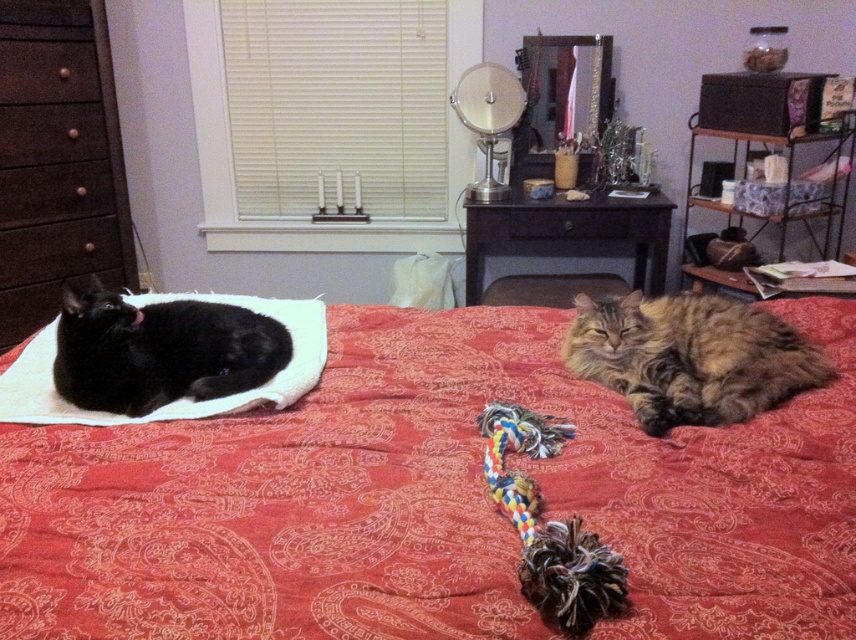
You are organizing a toy storage system in this room and need to place a large toy box. The toy box is the same size as the dark brown wood dresser at left. Can you fit another toy box of the same size next to the brown wood drawer at left?

The dark brown wood dresser at left is larger in size than the brown wood drawer at left. Since the toy box matches the size of the dresser, it would not fit next to the smaller drawer because the drawer is smaller and there isn

You are a photographer trying to capture a closeup of the tabby fur cat at center. You have a camera with a zoom lens that can focus on a specific point. The point you need to focus on is located at coordinates point (690,356). Based on the scene description, can you confirm if this point is on the tabby fur cat at center?

Yes, the point (690,356) is on the tabby fur cat at center according to the provided description.

You are a cat owner who wants to place a new toy between the tabby fur cat at center and the brown wood drawer at left. Based on their positions, which side of the toy should be closer to the drawer?

The tabby fur cat at center is to the right of the brown wood drawer at left, so the side of the toy closer to the drawer should be placed near the left side between them.